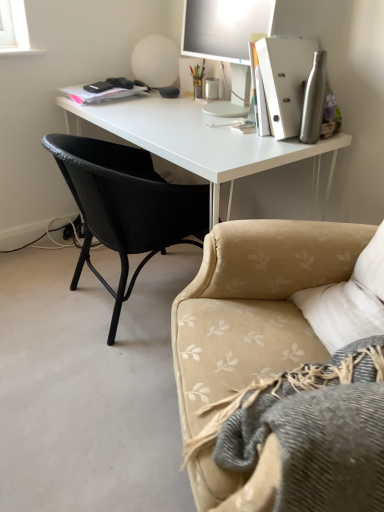
Locate an element on the screen. The height and width of the screenshot is (512, 384). free point above black woven chair at left (from a real-world perspective) is located at coordinates (158, 127).